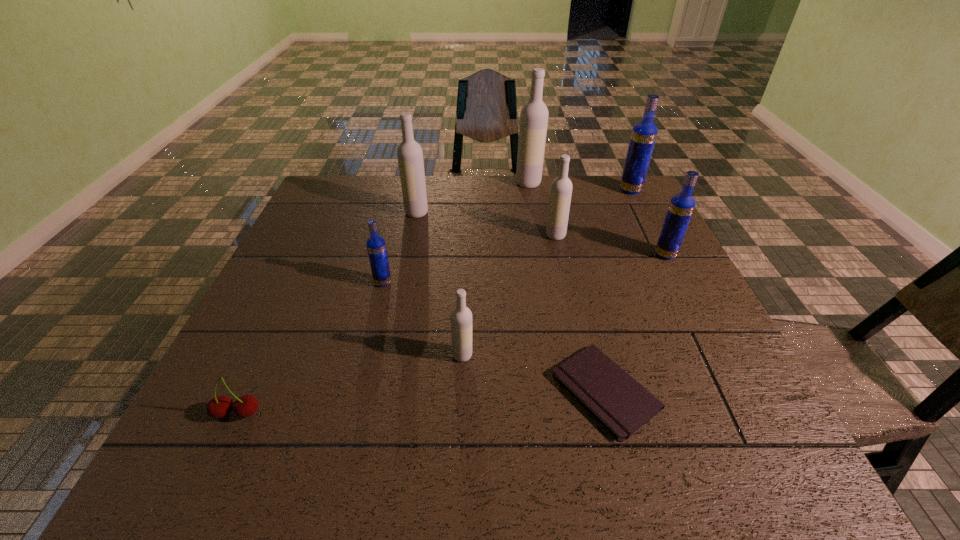
Where is `free space at the left edge`? free space at the left edge is located at coordinates (323, 256).

Find the location of a particular element. The height and width of the screenshot is (540, 960). vacant space at the right edge is located at coordinates (690, 417).

Find the location of a particular element. Image resolution: width=960 pixels, height=540 pixels. vacant space at the far left corner of the desktop is located at coordinates pos(359,190).

Find the location of a particular element. free space at the near left corner of the desktop is located at coordinates (240, 453).

Identify the location of free space between the nearest white vodka and the second smallest blue vodka. coord(564,305).

Where is `vacant space that's between the checkbook and the fourth object from left to right`? This screenshot has height=540, width=960. vacant space that's between the checkbook and the fourth object from left to right is located at coordinates (535, 373).

Image resolution: width=960 pixels, height=540 pixels. I want to click on free point between the farthest white vodka and the eighth tallest object, so click(x=383, y=298).

Where is `vacant space that's between the shortest object and the nearest blue vodka`? vacant space that's between the shortest object and the nearest blue vodka is located at coordinates (494, 336).

Identify the location of free spot between the leftmost object and the farthest blue vodka. The image size is (960, 540). (434, 302).

Locate an element on the screen. This screenshot has height=540, width=960. free space between the farthest blue vodka and the cherry is located at coordinates (434, 302).